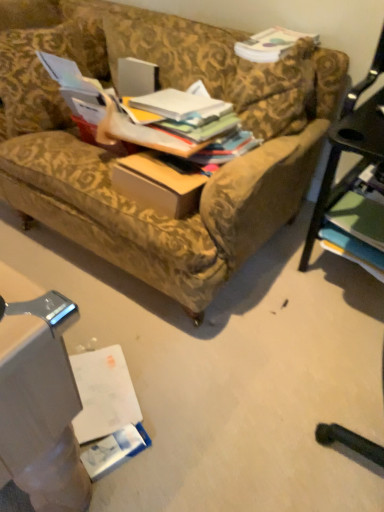
Question: Considering the relative sizes of multicolored paper stack at center, the fourth book when ordered from top to bottom, and green matte book at lower right, the 1th book when ordered from bottom to top, in the image provided, is multicolored paper stack at center, the fourth book when ordered from top to bottom, thinner than green matte book at lower right, the 1th book when ordered from bottom to top,?

Choices:
 (A) yes
 (B) no

Answer: (A)

Question: From a real-world perspective, is multicolored paper stack at center, positioned as the 2th book in bottom-to-top order, physically below green matte book at lower right, which appears as the fifth book when viewed from the top?

Choices:
 (A) yes
 (B) no

Answer: (B)

Question: Is multicolored paper stack at center, positioned as the 2th book in bottom-to-top order, beside green matte book at lower right, the 1th book when ordered from bottom to top?

Choices:
 (A) no
 (B) yes

Answer: (A)

Question: Is multicolored paper stack at center, positioned as the 2th book in bottom-to-top order, behind green matte book at lower right, which appears as the fifth book when viewed from the top?

Choices:
 (A) yes
 (B) no

Answer: (B)

Question: Is multicolored paper stack at center, the fourth book when ordered from top to bottom, outside of green matte book at lower right, which appears as the fifth book when viewed from the top?

Choices:
 (A) yes
 (B) no

Answer: (A)

Question: From the image's perspective, relative to matte white book at upper center, the 5th book from the bottom, is multicolored paper stack at center, the 3th book from the top, above or below?

Choices:
 (A) above
 (B) below

Answer: (B)

Question: In the image, is multicolored paper stack at center, the 3th book from the top, on the left side or the right side of matte white book at upper center, the 5th book from the bottom?

Choices:
 (A) left
 (B) right

Answer: (A)

Question: Is multicolored paper stack at center, which ranks as the 3th book in bottom-to-top order, taller or shorter than matte white book at upper center, placed as the first book when sorted from top to bottom?

Choices:
 (A) short
 (B) tall

Answer: (A)

Question: In the image, is multicolored paper stack at center, the 3th book from the top, positioned in front of or behind matte white book at upper center, the 5th book from the bottom?

Choices:
 (A) behind
 (B) front

Answer: (B)

Question: Is matte white book at upper center, the 5th book from the bottom, situated inside multicolored paper stack at center, the fourth book when ordered from top to bottom, or outside?

Choices:
 (A) outside
 (B) inside

Answer: (A)

Question: From a real-world perspective, is matte white book at upper center, the 5th book from the bottom, physically located above or below multicolored paper stack at center, the fourth book when ordered from top to bottom?

Choices:
 (A) below
 (B) above

Answer: (B)

Question: Considering the positions of matte white book at upper center, placed as the first book when sorted from top to bottom, and multicolored paper stack at center, the fourth book when ordered from top to bottom, in the image, is matte white book at upper center, placed as the first book when sorted from top to bottom, wider or thinner than multicolored paper stack at center, the fourth book when ordered from top to bottom,?

Choices:
 (A) thin
 (B) wide

Answer: (B)

Question: Is matte white book at upper center, placed as the first book when sorted from top to bottom, taller or shorter than multicolored paper stack at center, positioned as the 2th book in bottom-to-top order?

Choices:
 (A) short
 (B) tall

Answer: (B)

Question: Is white paper book at center, the 4th book from the bottom, bigger or smaller than green matte book at lower right, the 1th book when ordered from bottom to top?

Choices:
 (A) small
 (B) big

Answer: (A)

Question: Relative to green matte book at lower right, which appears as the fifth book when viewed from the top, is white paper book at center, the second book in the top-to-bottom sequence, in front or behind?

Choices:
 (A) front
 (B) behind

Answer: (A)